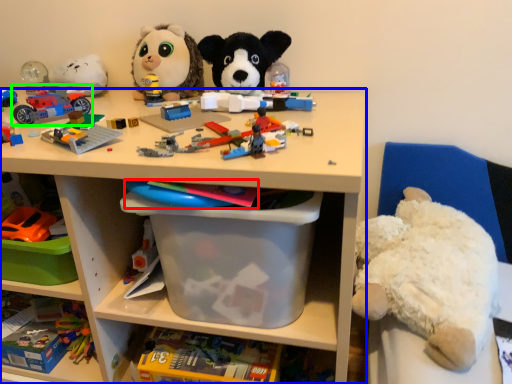
Question: Estimate the real-world distances between objects in this image. Which object is closer to toy (highlighted by a red box), shelf (highlighted by a blue box) or toy (highlighted by a green box)?

Choices:
 (A) shelf
 (B) toy

Answer: (A)